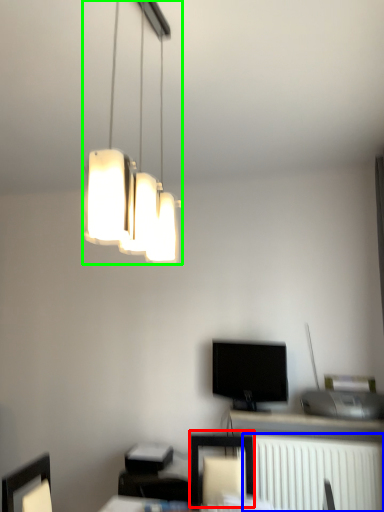
Question: Estimate the real-world distances between objects in this image. Which object is closer to furniture (highlighted by a red box), radiator (highlighted by a blue box) or lamp (highlighted by a green box)?

Choices:
 (A) radiator
 (B) lamp

Answer: (A)